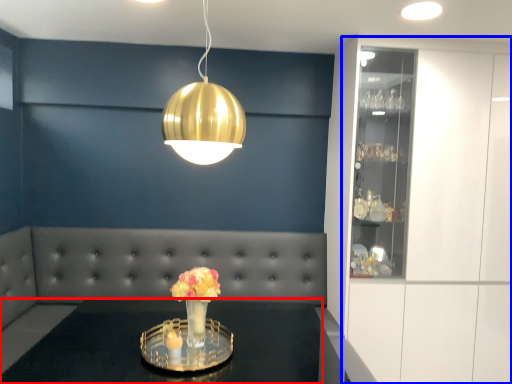
Question: Which object appears closest to the camera in this image, table (highlighted by a red box) or cabinetry (highlighted by a blue box)?

Choices:
 (A) table
 (B) cabinetry

Answer: (A)